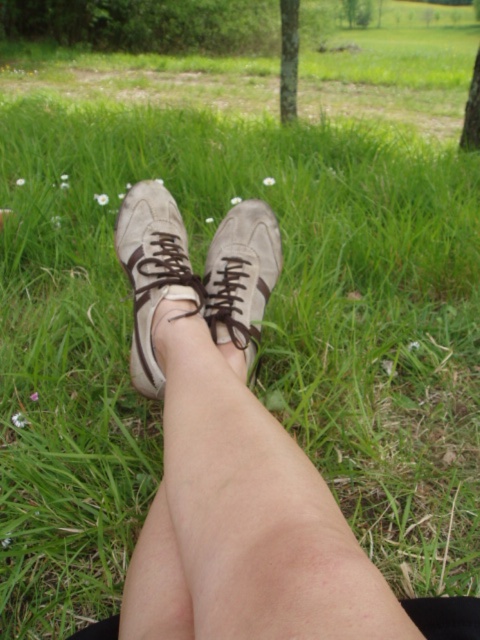
Question: Is matte beige sneaker at center thinner than suede/leather sneaker at center?

Choices:
 (A) yes
 (B) no

Answer: (B)

Question: Which point is farther to the camera?

Choices:
 (A) matte beige sneaker at center
 (B) suede/leather sneaker at center
 (C) green leafy tree at upper center

Answer: (C)

Question: Which object is the farthest from the green leafy tree at upper center?

Choices:
 (A) suede/leather sneaker at center
 (B) matte beige sneaker at center

Answer: (B)

Question: Among these points, which one is farthest from the camera?

Choices:
 (A) (173, 227)
 (B) (469, 145)

Answer: (B)

Question: Is suede/leather sneaker at center above green leafy tree at upper center?

Choices:
 (A) no
 (B) yes

Answer: (A)

Question: Is matte beige sneaker at center thinner than green leafy tree at upper center?

Choices:
 (A) no
 (B) yes

Answer: (B)